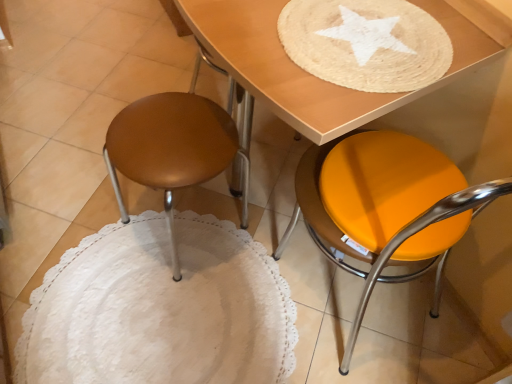
The image size is (512, 384). Identify the location of blank area beneath orange matte stool at lower right (from a real-world perspective). (365, 307).